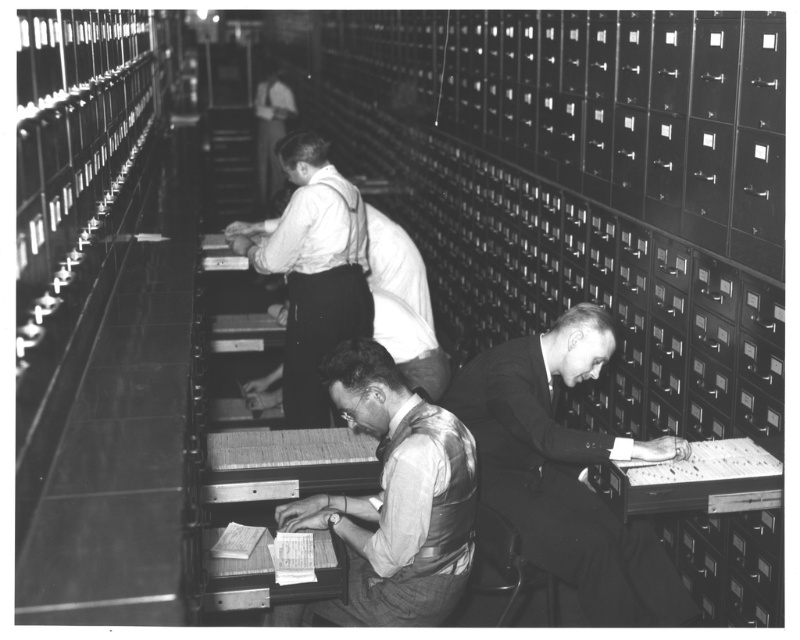
Question: Which object is farther from the camera taking this photo?

Choices:
 (A) light gray fabric vest at center
 (B) light gray shirt at center

Answer: (B)

Question: Which point is farther from the camera taking this photo?

Choices:
 (A) (596, 573)
 (B) (468, 563)
 (C) (306, 253)

Answer: (C)

Question: Is smooth black suit at center below light gray fabric vest at center?

Choices:
 (A) yes
 (B) no

Answer: (A)

Question: Is light gray fabric vest at center smaller than light gray shirt at center?

Choices:
 (A) yes
 (B) no

Answer: (A)

Question: Does light gray fabric vest at center lie behind light gray shirt at center?

Choices:
 (A) yes
 (B) no

Answer: (B)

Question: Which point is farther from the camera taking this photo?

Choices:
 (A) (441, 406)
 (B) (364, 253)
 (C) (656, 614)

Answer: (B)